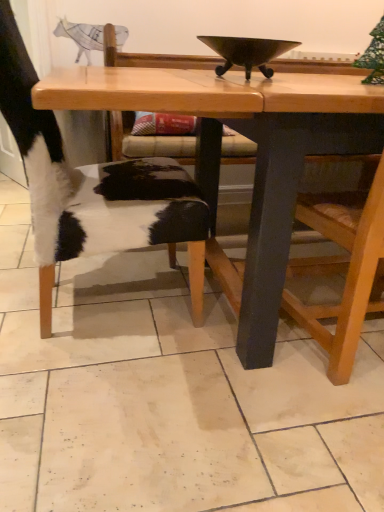
Where is `free point below shiny dark metal bowl at center (from a real-world perspective)`? This screenshot has width=384, height=512. free point below shiny dark metal bowl at center (from a real-world perspective) is located at coordinates (246, 77).